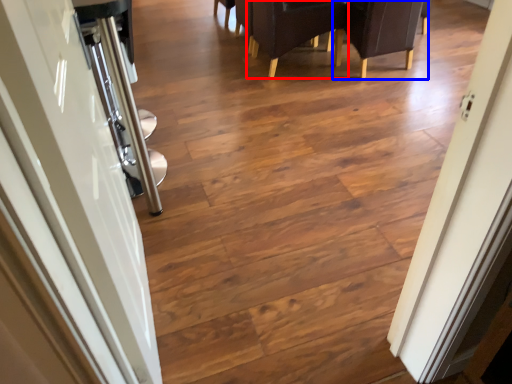
Question: Which object is further to the camera taking this photo, armchair (highlighted by a red box) or armchair (highlighted by a blue box)?

Choices:
 (A) armchair
 (B) armchair

Answer: (A)